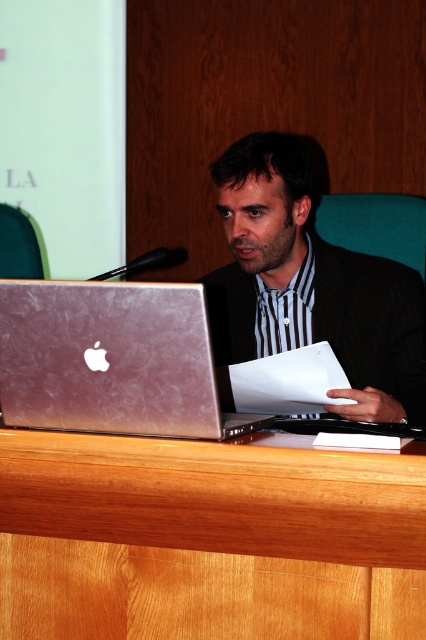
You are standing in front of the wooden table at center and the matte black suit at center. Which object is closer to the floor?

The wooden table at center is below matte black suit at center, so the wooden table at center is closer to the floor.

You are a person who is 1.7 meters tall. You want to sit on the teal fabric chair at center and use the wooden table at center for your laptop. Based on the scene, will your knees have enough space under the table?

The wooden table at center is taller than teal fabric chair at center, so when you sit on the teal fabric chair at center, your knees should have enough space under the wooden table at center since the table is higher than the chair.

You are a person who wants to place a new keyboard that is 30 cm wide on the desk between the silver metallic laptop at center and the green fabric chair at left. Based on the scene, can you determine if there is enough space between them to fit the keyboard?

The silver metallic laptop at center might be wider than green fabric chair at left, so it is uncertain if there is enough space between them to fit a 30 cm wide keyboard. Measure the distance first before placing it.